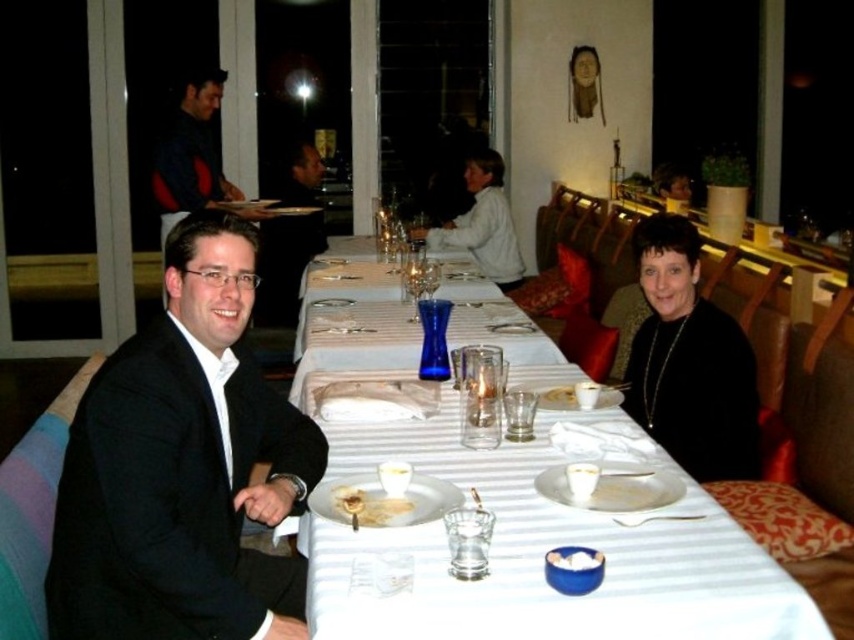
Question: Can you confirm if black silk dress at center is positioned to the left of white sweater at center?

Choices:
 (A) no
 (B) yes

Answer: (A)

Question: In this image, where is black suit at left located relative to black silk dress at center?

Choices:
 (A) below
 (B) above

Answer: (A)

Question: Is black suit at left to the left of white creamy food at center from the viewer's perspective?

Choices:
 (A) no
 (B) yes

Answer: (B)

Question: Which object is the closest to the white creamy food at center?

Choices:
 (A) black silk dress at center
 (B) white sweater at center
 (C) black suit at left
 (D) blue glass vase at center

Answer: (C)

Question: Which object appears closest to the camera in this image?

Choices:
 (A) black silk dress at center
 (B) white creamy food at center

Answer: (B)

Question: Which is nearer to the black silk dress at center?

Choices:
 (A) white sweater at center
 (B) blue glass vase at center
 (C) black suit at left

Answer: (C)